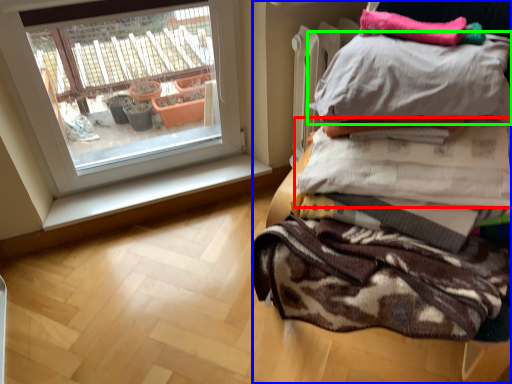
Question: Which object is positioned closest to blanket (highlighted by a red box)? Select from furniture (highlighted by a blue box) and pillow (highlighted by a green box).

Choices:
 (A) furniture
 (B) pillow

Answer: (B)